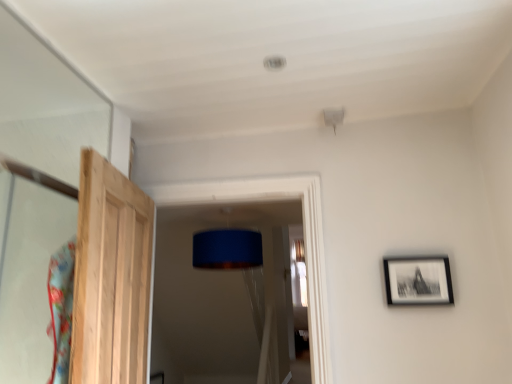
Question: Based on their sizes in the image, would you say natural wood door at left is bigger or smaller than black matte picture frame at right?

Choices:
 (A) small
 (B) big

Answer: (B)

Question: Relative to black matte picture frame at right, is natural wood door at left in front or behind?

Choices:
 (A) front
 (B) behind

Answer: (A)

Question: Is natural wood door at left taller or shorter than black matte picture frame at right?

Choices:
 (A) tall
 (B) short

Answer: (A)

Question: From the image's perspective, is black matte picture frame at right positioned above or below natural wood door at left?

Choices:
 (A) below
 (B) above

Answer: (A)

Question: Considering the positions of black matte picture frame at right and natural wood door at left in the image, is black matte picture frame at right taller or shorter than natural wood door at left?

Choices:
 (A) tall
 (B) short

Answer: (B)

Question: In terms of size, does black matte picture frame at right appear bigger or smaller than natural wood door at left?

Choices:
 (A) small
 (B) big

Answer: (A)

Question: Looking at their shapes, would you say black matte picture frame at right is wider or thinner than natural wood door at left?

Choices:
 (A) thin
 (B) wide

Answer: (A)